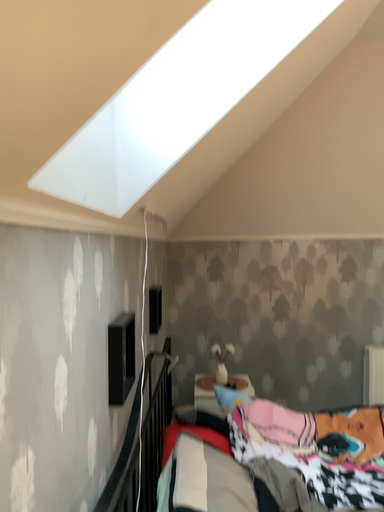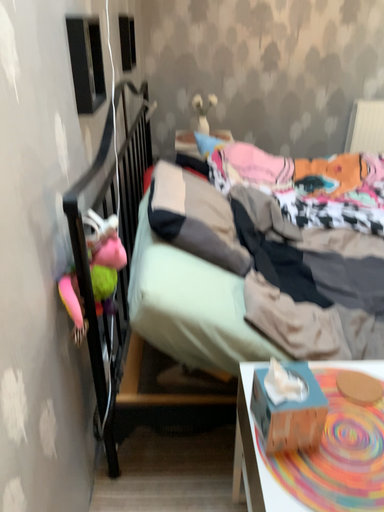
Question: How did the camera likely rotate when shooting the video?

Choices:
 (A) rotated upward
 (B) rotated downward

Answer: (B)